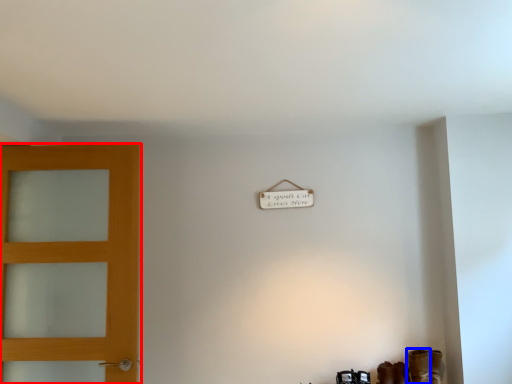
Question: Which object appears closest to the camera in this image, door (highlighted by a red box) or boot (highlighted by a blue box)?

Choices:
 (A) door
 (B) boot

Answer: (A)